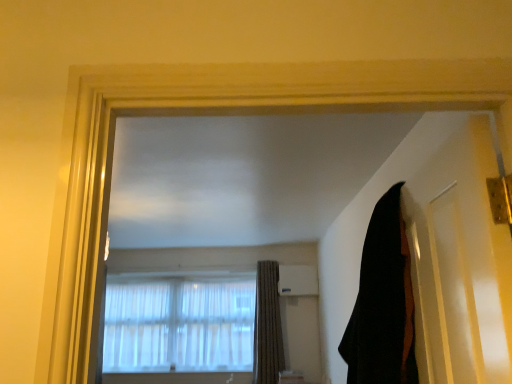
Describe the element at coordinates (179, 323) in the screenshot. The image size is (512, 384). I see `translucent fabric at center` at that location.

What do you see at coordinates (267, 326) in the screenshot? Image resolution: width=512 pixels, height=384 pixels. I see `beige textured curtain at center, the first curtain in the back-to-front sequence` at bounding box center [267, 326].

Measure the distance between beige textured curtain at center, acting as the 2th curtain starting from the front, and camera.

A distance of 4.75 meters exists between beige textured curtain at center, acting as the 2th curtain starting from the front, and camera.

Locate an element on the screen. This screenshot has width=512, height=384. black fabric curtain at right, arranged as the second curtain when viewed from the left is located at coordinates (383, 303).

In terms of size, does translucent fabric at center appear bigger or smaller than black matte door at right?

Clearly, translucent fabric at center is larger in size than black matte door at right.

Considering the positions of points (218, 334) and (417, 279), is point (218, 334) closer to camera compared to point (417, 279)?

No.

How many degrees apart are the facing directions of translucent fabric at center and black matte door at right?

94.2 degrees separate the facing orientations of translucent fabric at center and black matte door at right.

Which object is closer to the camera, translucent fabric at center or black matte door at right?

black matte door at right is more forward.

Based on their sizes in the image, would you say black fabric curtain at right, marked as the second curtain in a back-to-front arrangement, is bigger or smaller than black matte door at right?

In the image, black fabric curtain at right, marked as the second curtain in a back-to-front arrangement, appears to be larger than black matte door at right.

Is black fabric curtain at right, which ranks as the 2th curtain in bottom-to-top order, behind black matte door at right?

Yes, it is.

Is black fabric curtain at right, which ranks as the 2th curtain in bottom-to-top order, directly adjacent to black matte door at right?

No, black fabric curtain at right, which ranks as the 2th curtain in bottom-to-top order, is not beside black matte door at right.

Is point (366, 302) closer to camera compared to point (475, 351)?

No, it is not.

From the image's perspective, does black fabric curtain at right, marked as the second curtain in a back-to-front arrangement, appear higher than translucent fabric at center?

Yes, from the image's perspective, black fabric curtain at right, marked as the second curtain in a back-to-front arrangement, is on top of translucent fabric at center.

Where is `window lying below the black fabric curtain at right, which ranks as the 2th curtain in bottom-to-top order (from the image's perspective)`? window lying below the black fabric curtain at right, which ranks as the 2th curtain in bottom-to-top order (from the image's perspective) is located at coordinates point(179,323).

Is black fabric curtain at right, arranged as the second curtain when viewed from the left, wider than translucent fabric at center?

Correct, the width of black fabric curtain at right, arranged as the second curtain when viewed from the left, exceeds that of translucent fabric at center.

Is black fabric curtain at right, arranged as the first curtain when viewed from the top, in front of or behind translucent fabric at center in the image?

Clearly, black fabric curtain at right, arranged as the first curtain when viewed from the top, is in front of translucent fabric at center.

From a real-world perspective, which is physically below, black matte door at right or black fabric curtain at right, which ranks as the 2th curtain in bottom-to-top order?

black fabric curtain at right, which ranks as the 2th curtain in bottom-to-top order, is physically lower.

Find the location of a particular element. The height and width of the screenshot is (384, 512). door in front of the black fabric curtain at right, marked as the second curtain in a back-to-front arrangement is located at coordinates (457, 251).

Does black matte door at right have a smaller size compared to black fabric curtain at right, the first curtain viewed from the right?

Correct, black matte door at right occupies less space than black fabric curtain at right, the first curtain viewed from the right.

From the image's perspective, would you say beige textured curtain at center, the first curtain in the back-to-front sequence, is shown under translucent fabric at center?

No.

Based on the photo, does beige textured curtain at center, the first curtain in the back-to-front sequence, turn towards translucent fabric at center?

No.

Can we say black fabric curtain at right, the first curtain viewed from the right, lies outside beige textured curtain at center, acting as the 2th curtain starting from the front?

black fabric curtain at right, the first curtain viewed from the right, is positioned outside beige textured curtain at center, acting as the 2th curtain starting from the front.

Between black fabric curtain at right, marked as the second curtain in a back-to-front arrangement, and beige textured curtain at center, the first curtain in the back-to-front sequence, which one is positioned behind?

Positioned behind is beige textured curtain at center, the first curtain in the back-to-front sequence.

Does point (399, 276) appear closer or farther from the camera than point (257, 272)?

Point (399, 276) is closer to the camera than point (257, 272).

From the image's perspective, is black fabric curtain at right, which is the first curtain from front to back, beneath beige textured curtain at center, acting as the 2th curtain starting from the front?

No.

Locate an element on the screen. This screenshot has height=384, width=512. window below the black matte door at right (from a real-world perspective) is located at coordinates (179, 323).

Based on the photo, how far apart are black matte door at right and translucent fabric at center?

black matte door at right and translucent fabric at center are 4.31 meters apart.

Is black matte door at right next to translucent fabric at center and touching it?

No, black matte door at right is not beside translucent fabric at center.

Relative to translucent fabric at center, is black matte door at right in front or behind?

Clearly, black matte door at right is in front of translucent fabric at center.

The image size is (512, 384). I want to click on window on the left of black matte door at right, so click(x=179, y=323).

At what (x,y) coordinates should I click in order to perform the action: click on curtain that is the 1st object directly below the black matte door at right (from a real-world perspective). Please return your answer as a coordinate pair (x, y). Looking at the image, I should click on (383, 303).

Estimate the real-world distances between objects in this image. Which object is closer to beige textured curtain at center, acting as the 2th curtain starting from the front, black fabric curtain at right, which ranks as the 2th curtain in bottom-to-top order, or black matte door at right?

Among the two, black fabric curtain at right, which ranks as the 2th curtain in bottom-to-top order, is located nearer to beige textured curtain at center, acting as the 2th curtain starting from the front.

Estimate the real-world distances between objects in this image. Which object is further from translucent fabric at center, beige textured curtain at center, which is the second curtain in top-to-bottom order, or black matte door at right?

The object further to translucent fabric at center is black matte door at right.

Considering their positions, is beige textured curtain at center, the first curtain in the back-to-front sequence, positioned further to translucent fabric at center than black fabric curtain at right, arranged as the second curtain when viewed from the left?

Among the two, black fabric curtain at right, arranged as the second curtain when viewed from the left, is located further to translucent fabric at center.

From the image, which object appears to be farther from beige textured curtain at center, marked as the 1th curtain in a bottom-to-top arrangement, black matte door at right or translucent fabric at center?

black matte door at right is further to beige textured curtain at center, marked as the 1th curtain in a bottom-to-top arrangement.

In the scene shown: When comparing their distances from black fabric curtain at right, arranged as the second curtain when viewed from the left, does translucent fabric at center or black matte door at right seem further?

translucent fabric at center lies further to black fabric curtain at right, arranged as the second curtain when viewed from the left, than the other object.

Looking at the image, which one is located closer to translucent fabric at center, black matte door at right or black fabric curtain at right, the first curtain viewed from the right?

black fabric curtain at right, the first curtain viewed from the right.

Based on their spatial positions, is translucent fabric at center or beige textured curtain at center, the first curtain in the back-to-front sequence, closer to black matte door at right?

The object closer to black matte door at right is beige textured curtain at center, the first curtain in the back-to-front sequence.

Which object lies further to the anchor point black matte door at right, black fabric curtain at right, which is the first curtain from front to back, or beige textured curtain at center, the first curtain when ordered from left to right?

Among the two, beige textured curtain at center, the first curtain when ordered from left to right, is located further to black matte door at right.

You are a GUI agent. You are given a task and a screenshot of the screen. Output one action in this format:
    pyautogui.click(x=<x>, y=<y>)
    Task: Click on the curtain between black fabric curtain at right, arranged as the first curtain when viewed from the top, and translucent fabric at center from front to back
    
    Given the screenshot: What is the action you would take?
    pyautogui.click(x=267, y=326)

I want to click on curtain between black matte door at right and beige textured curtain at center, which is the second curtain in top-to-bottom order, in the front-back direction, so click(x=383, y=303).